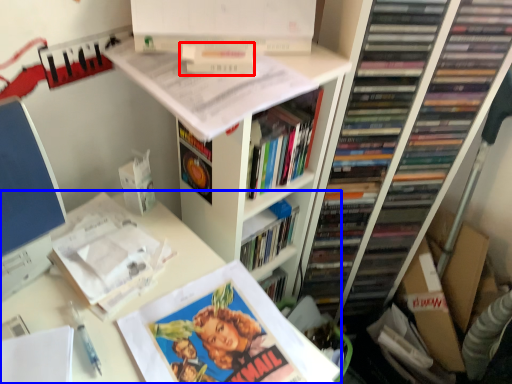
Question: Among these objects, which one is farthest to the camera, book (highlighted by a red box) or computer desk (highlighted by a blue box)?

Choices:
 (A) book
 (B) computer desk

Answer: (A)